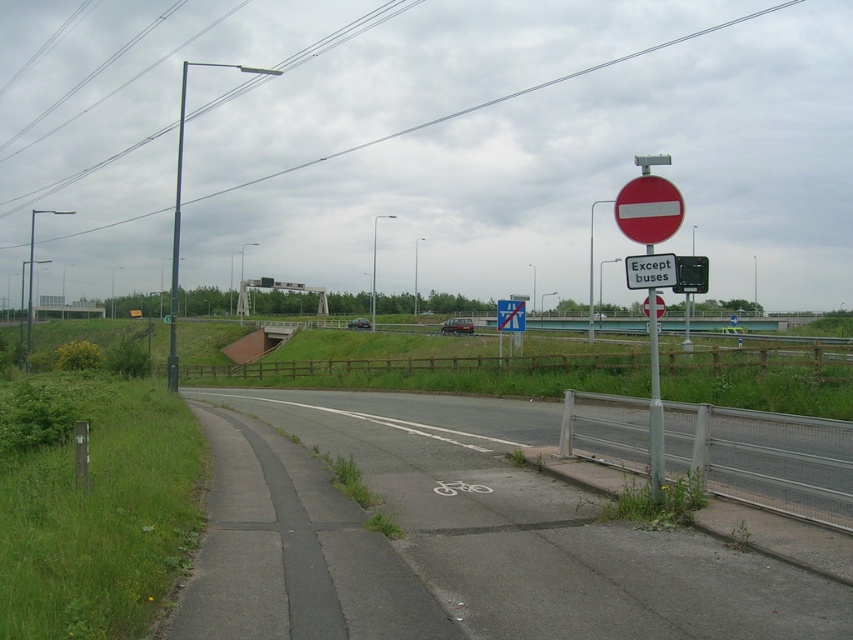
Question: Which of these objects is positioned closest to the red matte stop sign at upper right?

Choices:
 (A) asphalt road at lower left
 (B) white plastic sign at upper center
 (C) metallic pole at upper right

Answer: (B)

Question: Among these points, which one is nearest to the camera?

Choices:
 (A) (659, 307)
 (B) (627, 268)
 (C) (503, 328)

Answer: (B)

Question: From the image, what is the correct spatial relationship of asphalt road at lower left in relation to red matte stop sign at upper right?

Choices:
 (A) left
 (B) right

Answer: (A)

Question: Which object is the closest to the white plastic sign at upper center?

Choices:
 (A) red matte stop sign at upper right
 (B) asphalt road at lower left

Answer: (A)

Question: Is red matte sign at upper right thinner than white plastic sign at upper center?

Choices:
 (A) no
 (B) yes

Answer: (A)

Question: In this image, where is metallic pole at upper right located relative to white plastic sign at upper center?

Choices:
 (A) below
 (B) above

Answer: (B)